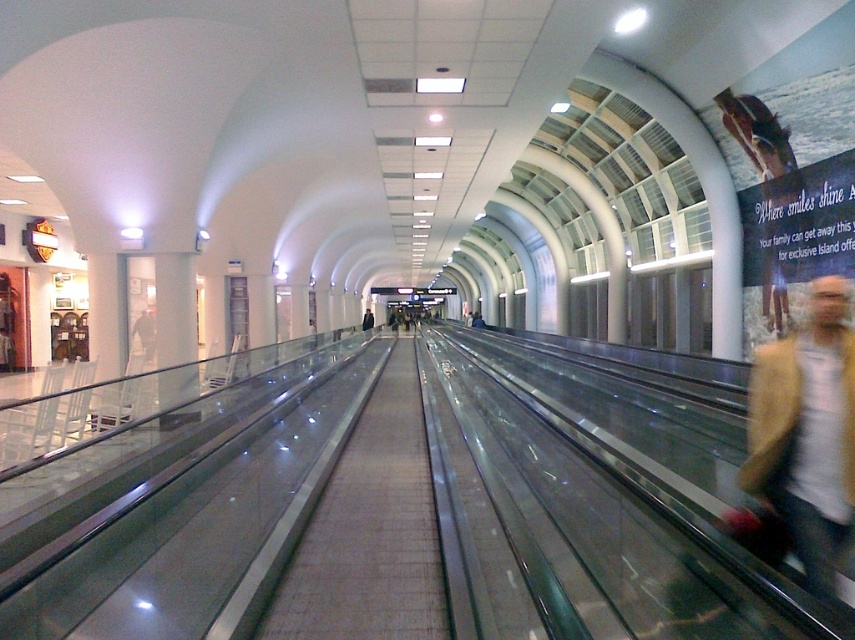
This screenshot has width=855, height=640. Find the location of `light brown leather jacket at lower right`. light brown leather jacket at lower right is located at coordinates (806, 433).

Where is `light brown leather jacket at lower right`? light brown leather jacket at lower right is located at coordinates (806, 433).

Where is `light brown leather jacket at lower right`? This screenshot has width=855, height=640. light brown leather jacket at lower right is located at coordinates (806, 433).